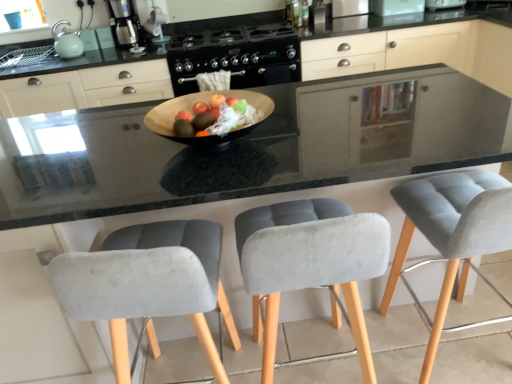
Question: From the image's perspective, is brushed metal toaster at upper center, which ranks as the third appliance in left-to-right order, on gray fabric chair at center, arranged as the 1th chair when viewed from the left?

Choices:
 (A) yes
 (B) no

Answer: (A)

Question: Does brushed metal toaster at upper center, which is counted as the 3th appliance, starting from the right, have a greater width compared to gray fabric chair at center, arranged as the 1th chair when viewed from the left?

Choices:
 (A) no
 (B) yes

Answer: (A)

Question: From the image's perspective, is brushed metal toaster at upper center, which ranks as the third appliance in left-to-right order, below gray fabric chair at center, the 3th chair viewed from the right?

Choices:
 (A) no
 (B) yes

Answer: (A)

Question: Is gray fabric chair at center, the 3th chair viewed from the right, completely or partially inside brushed metal toaster at upper center, which ranks as the third appliance in left-to-right order?

Choices:
 (A) no
 (B) yes

Answer: (A)

Question: Is brushed metal toaster at upper center, which ranks as the third appliance in left-to-right order, looking in the opposite direction of gray fabric chair at center, the 3th chair viewed from the right?

Choices:
 (A) yes
 (B) no

Answer: (B)

Question: Choose the correct answer: Is white glossy microwave at upper center, the fourth appliance positioned from the left, inside velvet grey bar stool at right, the 3th chair positioned from the left, or outside it?

Choices:
 (A) outside
 (B) inside

Answer: (A)

Question: Considering the positions of point coord(389,6) and point coord(494,190), is point coord(389,6) closer or farther from the camera than point coord(494,190)?

Choices:
 (A) farther
 (B) closer

Answer: (A)

Question: From the image's perspective, is white glossy microwave at upper center, the second appliance viewed from the right, positioned above or below velvet grey bar stool at right, marked as the first chair in a right-to-left arrangement?

Choices:
 (A) above
 (B) below

Answer: (A)

Question: In the image, is white glossy microwave at upper center, the fourth appliance positioned from the left, on the left side or the right side of velvet grey bar stool at right, marked as the first chair in a right-to-left arrangement?

Choices:
 (A) right
 (B) left

Answer: (A)

Question: Is velvet grey chair at center, positioned as the second chair in right-to-left order, inside the boundaries of white glossy microwave at upper center, the fourth appliance positioned from the left, or outside?

Choices:
 (A) outside
 (B) inside

Answer: (A)

Question: From the image's perspective, is velvet grey chair at center, positioned as the 2th chair in left-to-right order, above or below white glossy microwave at upper center, the fourth appliance positioned from the left?

Choices:
 (A) below
 (B) above

Answer: (A)

Question: In the image, is velvet grey chair at center, positioned as the second chair in right-to-left order, positioned in front of or behind white glossy microwave at upper center, the second appliance viewed from the right?

Choices:
 (A) front
 (B) behind

Answer: (A)

Question: Considering the positions of velvet grey chair at center, positioned as the 2th chair in left-to-right order, and white glossy microwave at upper center, the fourth appliance positioned from the left, in the image, is velvet grey chair at center, positioned as the 2th chair in left-to-right order, taller or shorter than white glossy microwave at upper center, the fourth appliance positioned from the left,?

Choices:
 (A) short
 (B) tall

Answer: (B)

Question: In terms of size, does satin silver coffee maker at upper left appear bigger or smaller than velvet grey chair at center, positioned as the 2th chair in left-to-right order?

Choices:
 (A) small
 (B) big

Answer: (A)

Question: Is satin silver coffee maker at upper left in front of or behind velvet grey chair at center, positioned as the 2th chair in left-to-right order, in the image?

Choices:
 (A) behind
 (B) front

Answer: (A)